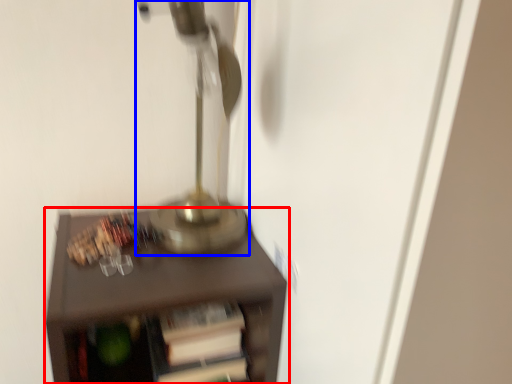
Question: Which object appears closest to the camera in this image, furniture (highlighted by a red box) or table lamp (highlighted by a blue box)?

Choices:
 (A) furniture
 (B) table lamp

Answer: (B)